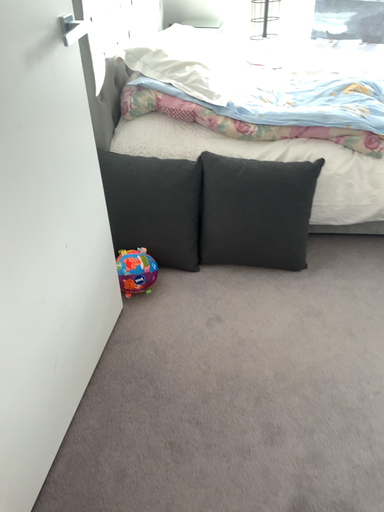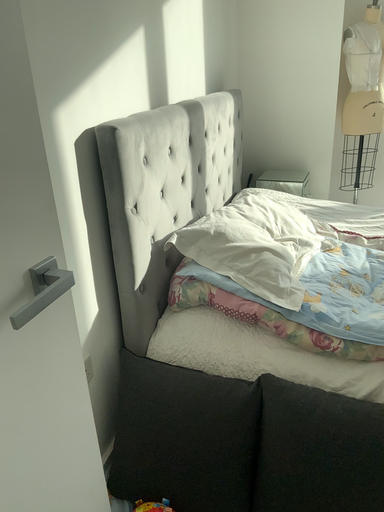
Question: How did the camera likely rotate when shooting the video?

Choices:
 (A) rotated upward
 (B) rotated downward

Answer: (A)